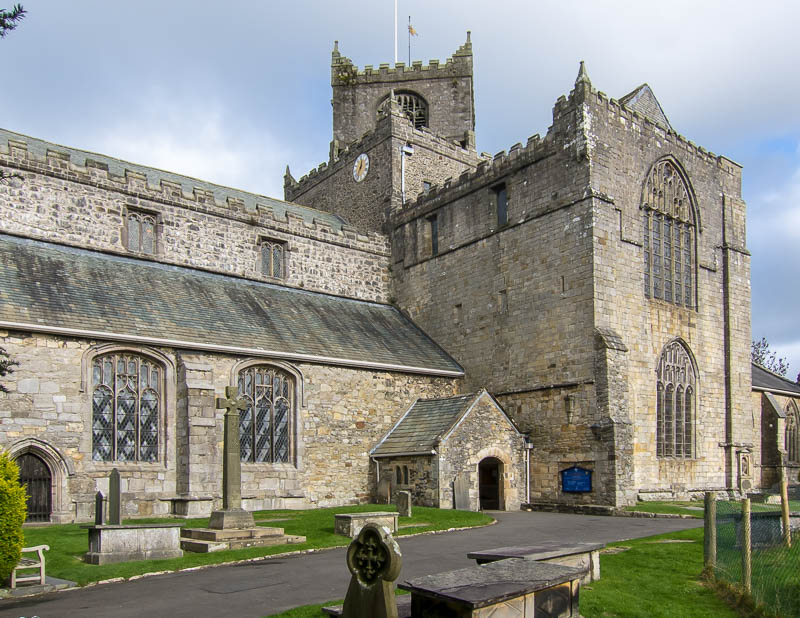
The image size is (800, 618). In order to click on entrance in this screenshot , I will do `click(490, 481)`.